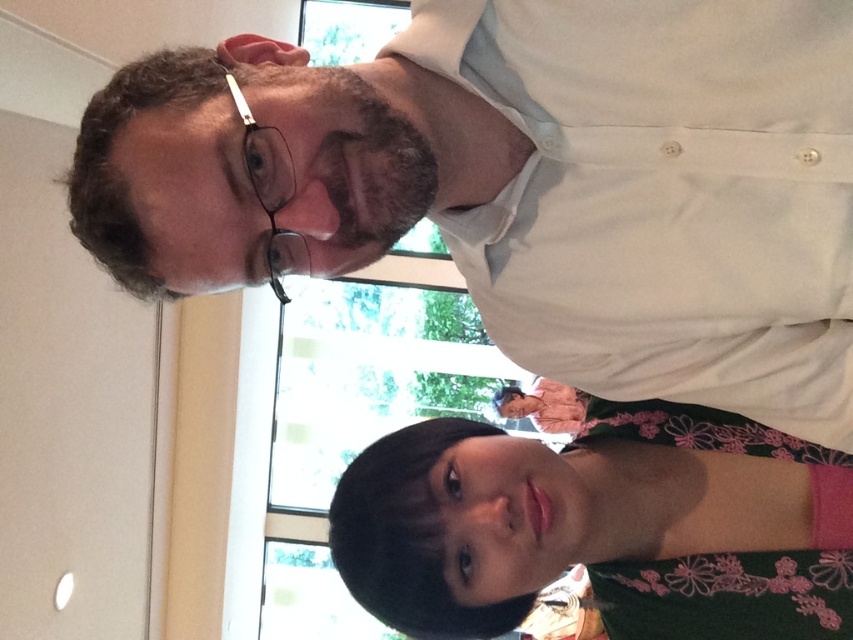
Is white matte shirt at upper center smaller than dark green floral dress at lower center?

No.

Who is more distant from viewer, (248, 236) or (675, 634)?

The point (675, 634) is more distant.

Locate an element on the screen. The image size is (853, 640). white matte shirt at upper center is located at coordinates (608, 188).

Locate an element on the screen. The width and height of the screenshot is (853, 640). white matte shirt at upper center is located at coordinates (608, 188).

Describe the element at coordinates (608, 188) in the screenshot. I see `white matte shirt at upper center` at that location.

Who is more distant from viewer, (584, 77) or (280, 161)?

The point (584, 77) is more distant.

The image size is (853, 640). In order to click on white matte shirt at upper center in this screenshot , I will do `click(608, 188)`.

Describe the element at coordinates (601, 525) in the screenshot. I see `dark green floral dress at lower center` at that location.

Who is lower down, dark green floral dress at lower center or silver metallic glasses at upper left?

dark green floral dress at lower center is lower down.

Locate an element on the screen. The width and height of the screenshot is (853, 640). dark green floral dress at lower center is located at coordinates (601, 525).